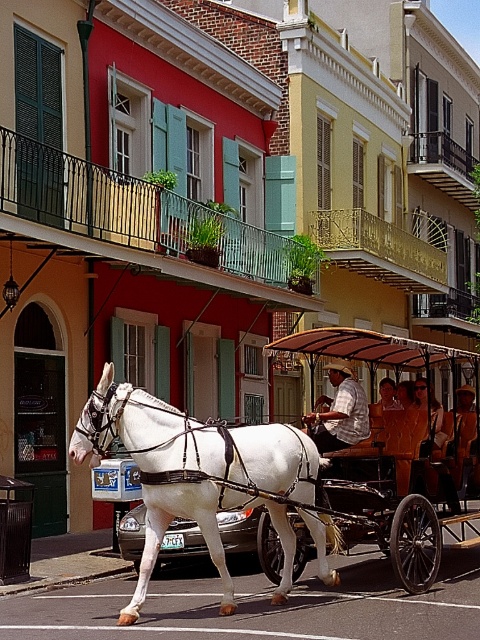
Between point (100, 380) and point (350, 442), which one is positioned in front?

Point (100, 380) is in front.

Can you confirm if white glossy horse at center is positioned to the right of wooden coach at center?

No, white glossy horse at center is not to the right of wooden coach at center.

Locate an element on the screen. The width and height of the screenshot is (480, 640). white glossy horse at center is located at coordinates (196, 474).

Where is `white glossy horse at center`? white glossy horse at center is located at coordinates (196, 474).